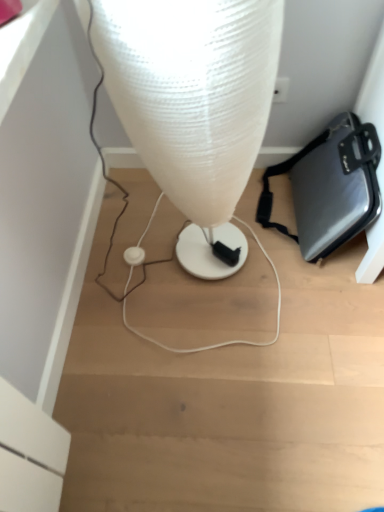
Locate an element on the screen. The height and width of the screenshot is (512, 384). vacant space in metallic gray briefcase at lower right (from a real-world perspective) is located at coordinates (292, 231).